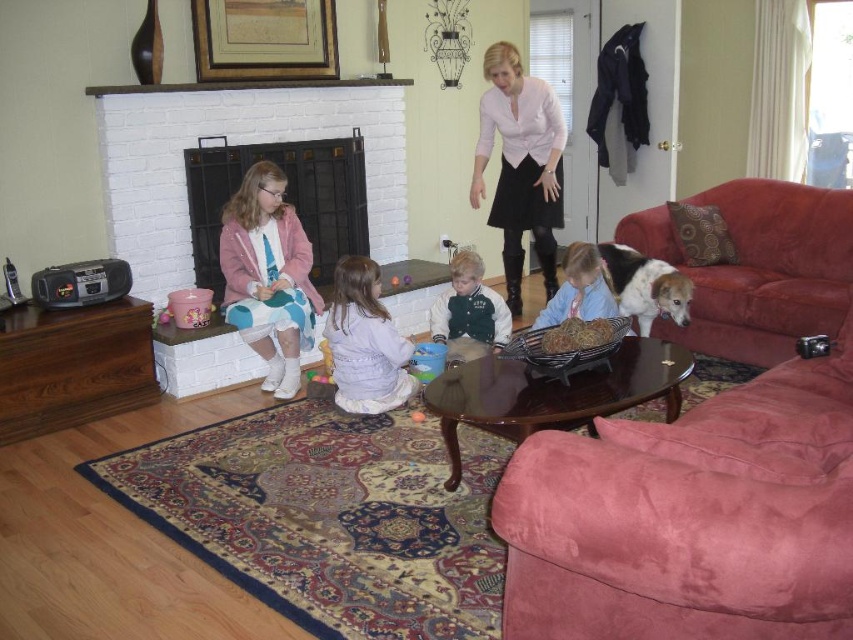
Question: Which of these objects is positioned farthest from the suede-like pink armchair at lower right?

Choices:
 (A) velvet red couch at right
 (B) green velvety jacket at center
 (C) light purple fabric dress at center

Answer: (B)

Question: In this image, where is suede-like pink armchair at lower right located relative to green velvety jacket at center?

Choices:
 (A) above
 (B) below

Answer: (B)

Question: Is suede-like pink armchair at lower right behind white brick fireplace at left?

Choices:
 (A) no
 (B) yes

Answer: (A)

Question: Can you confirm if white matte blouse at upper center is bigger than rubber orange ball at center?

Choices:
 (A) no
 (B) yes

Answer: (B)

Question: Which point is farther from the camera taking this photo?

Choices:
 (A) [534, 321]
 (B) [213, 241]

Answer: (B)

Question: Which point is farther to the camera?

Choices:
 (A) (514, 131)
 (B) (584, 268)
 (C) (357, 275)

Answer: (A)